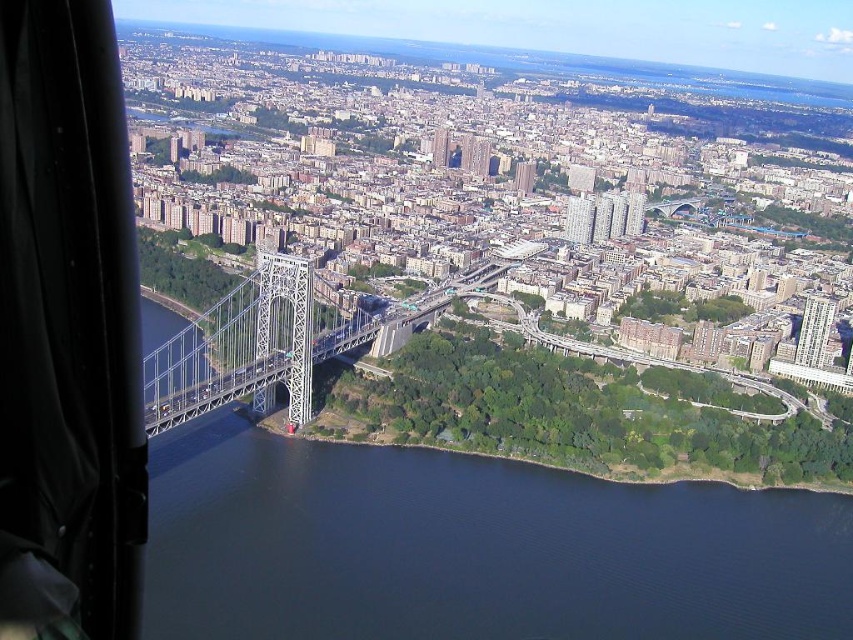
Is point (262, 634) closer to camera compared to point (253, 353)?

Yes.

Can you confirm if dark blue water at lower center is positioned below white metallic suspension bridge at center?

Indeed, dark blue water at lower center is positioned under white metallic suspension bridge at center.

Which is in front, point (479, 512) or point (312, 312)?

Positioned in front is point (479, 512).

Where is `dark blue water at lower center`? Image resolution: width=853 pixels, height=640 pixels. dark blue water at lower center is located at coordinates (473, 547).